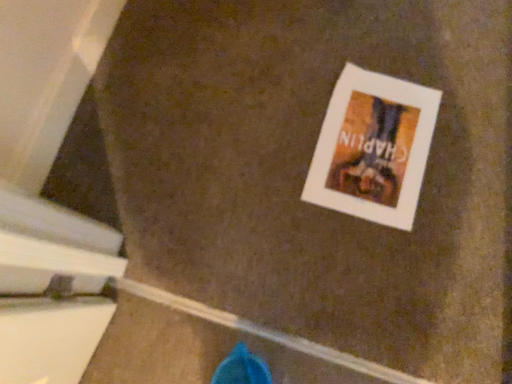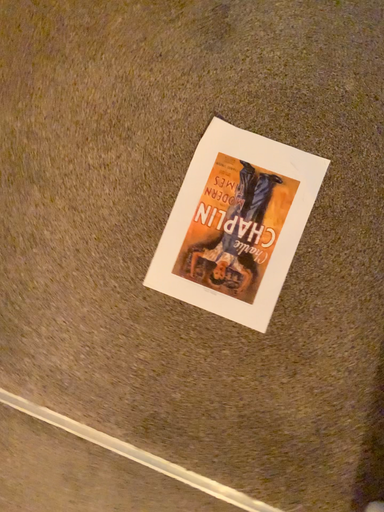
Question: Which way did the camera rotate in the video?

Choices:
 (A) rotated downward
 (B) rotated upward

Answer: (A)